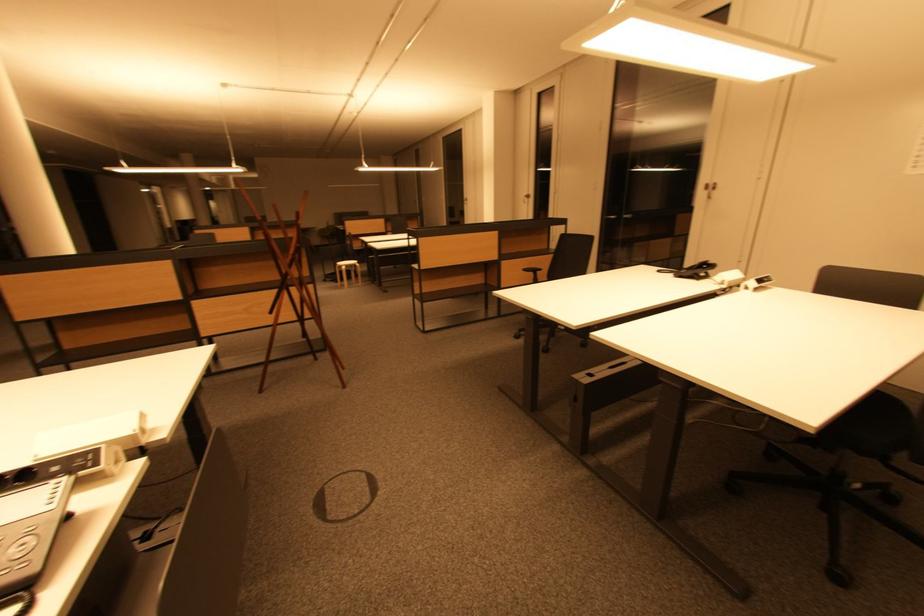
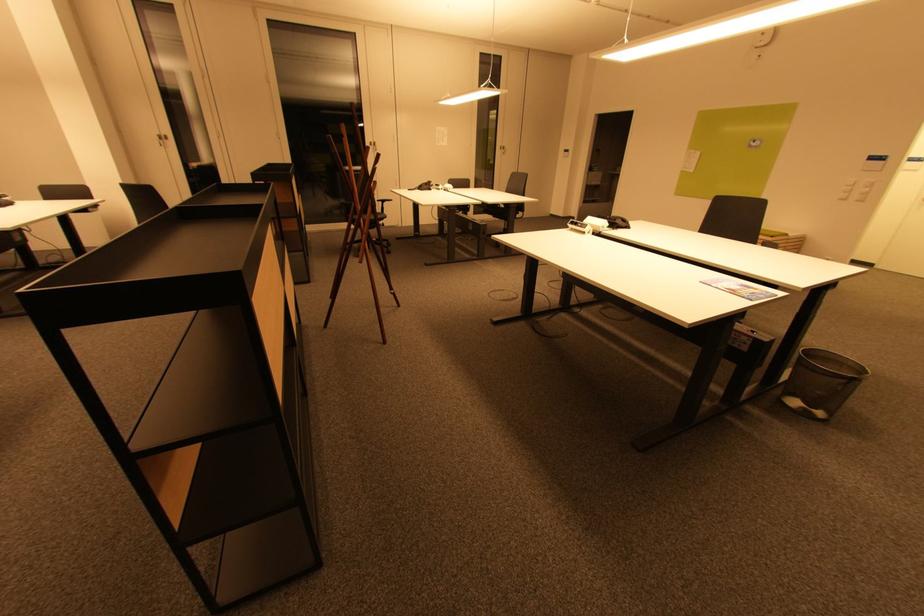
Locate, in the second image, the point that corresponds to point 531,198 in the first image.

(166, 140)